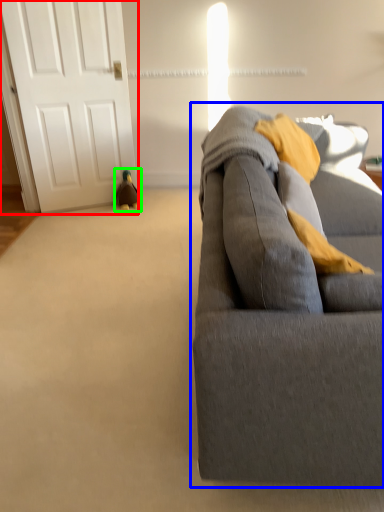
Question: Which is farther away from door (highlighted by a red box)? studio couch (highlighted by a blue box) or toy (highlighted by a green box)?

Choices:
 (A) studio couch
 (B) toy

Answer: (A)